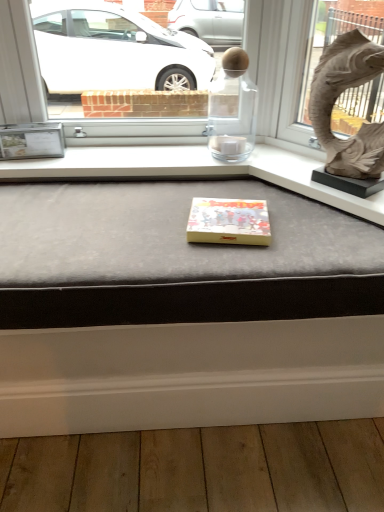
Question: Considering the relative sizes of matte gray cushion at center and matte stone animal at upper right in the image provided, is matte gray cushion at center smaller than matte stone animal at upper right?

Choices:
 (A) no
 (B) yes

Answer: (A)

Question: Is matte gray cushion at center looking in the opposite direction of matte stone animal at upper right?

Choices:
 (A) no
 (B) yes

Answer: (A)

Question: Is matte gray cushion at center to the right of matte stone animal at upper right from the viewer's perspective?

Choices:
 (A) yes
 (B) no

Answer: (B)

Question: Is matte gray cushion at center oriented towards matte stone animal at upper right?

Choices:
 (A) no
 (B) yes

Answer: (A)

Question: Is matte gray cushion at center taller than matte stone animal at upper right?

Choices:
 (A) yes
 (B) no

Answer: (B)

Question: Could matte stone animal at upper right be considered to be inside matte gray cushion at center?

Choices:
 (A) yes
 (B) no

Answer: (B)

Question: Can you confirm if yellow matte box at center is shorter than matte gray cushion at center?

Choices:
 (A) yes
 (B) no

Answer: (A)

Question: From a real-world perspective, is yellow matte box at center positioned over matte gray cushion at center based on gravity?

Choices:
 (A) yes
 (B) no

Answer: (B)

Question: Considering the relative sizes of yellow matte box at center and matte gray cushion at center in the image provided, is yellow matte box at center taller than matte gray cushion at center?

Choices:
 (A) no
 (B) yes

Answer: (A)

Question: Is yellow matte box at center not inside matte gray cushion at center?

Choices:
 (A) yes
 (B) no

Answer: (B)

Question: Is yellow matte box at center positioned with its back to matte gray cushion at center?

Choices:
 (A) no
 (B) yes

Answer: (A)

Question: Could you tell me if yellow matte box at center is turned towards matte gray cushion at center?

Choices:
 (A) no
 (B) yes

Answer: (A)

Question: Is yellow matte box at center smaller than matte stone animal at upper right?

Choices:
 (A) no
 (B) yes

Answer: (B)